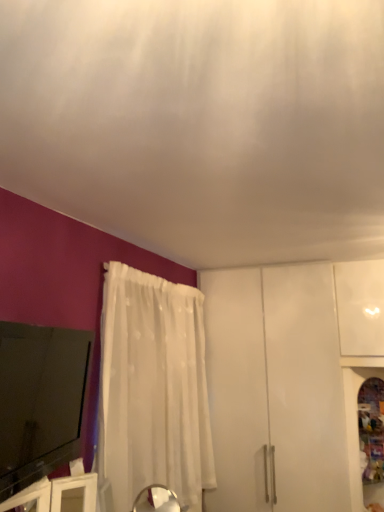
Question: Is white sheer curtain at lower center taller or shorter than black glossy tv at lower left?

Choices:
 (A) short
 (B) tall

Answer: (A)

Question: From a real-world perspective, relative to black glossy tv at lower left, is white sheer curtain at lower center vertically above or below?

Choices:
 (A) above
 (B) below

Answer: (A)

Question: Based on their relative distances, which object is farther from the black glossy tv at lower left?

Choices:
 (A) white sheer curtain at lower center
 (B) white sheer curtain at left
 (C) white glossy cabinet at lower right

Answer: (C)

Question: Which object is positioned farthest from the white sheer curtain at left?

Choices:
 (A) black glossy tv at lower left
 (B) white glossy cabinet at lower right
 (C) white sheer curtain at lower center

Answer: (B)